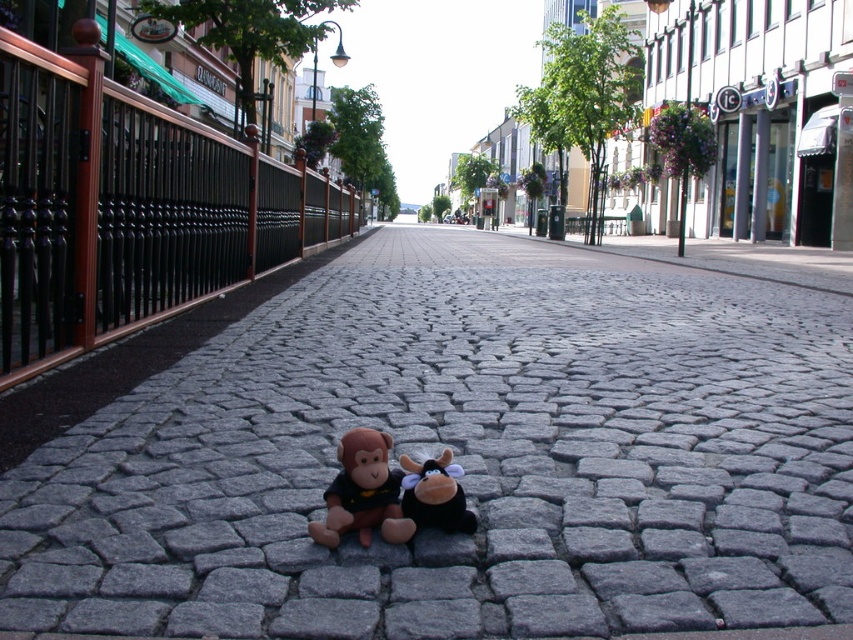
You are a delivery robot trying to place a package on the gray cobblestone pavement at center. However, there is a brown plush monkey at center in the way. Can you place the package directly on the pavement without moving the monkey?

The gray cobblestone pavement at center is positioned under brown plush monkey at center, meaning the monkey is resting on top of the pavement. Therefore, you can place the package on the pavement beneath the monkey as long as there is space around or beside it, but you cannot place it directly under the monkey without moving it.

From the picture: You are a delivery drone flying over the cobblestone street. You need to land on the gray cobblestone pavement at center to deliver a package. However, there is a black plush toy at center in the way. Can you safely land on the pavement without hitting the toy?

The gray cobblestone pavement at center has a lesser height compared to the black plush toy at center. Since the pavement is lower, the drone can safely land on it as long as it positions itself below the height of the toy.

Based on the photo, you are a delivery person who needs to place a small package between the brown plush monkey at center and the black plush toy at center on the cobblestone street. Can you fit the package between them if the package is 10 cm wide?

The brown plush monkey at center is wider than the black plush toy at center. Since the package is 10 cm wide, you need to check the space between them. However, the exact distance between the two plush toys isn